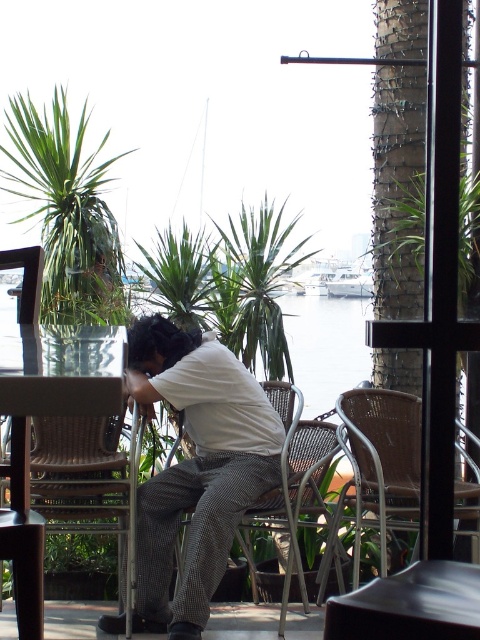
Question: Which of the following is the closest to the observer?

Choices:
 (A) (101, 296)
 (B) (40, 573)

Answer: (B)

Question: Can you confirm if green leafy plant at upper left is wider than woven wicker chair at center?

Choices:
 (A) no
 (B) yes

Answer: (B)

Question: Which point is farther to the camera?

Choices:
 (A) woven wicker chair at center
 (B) woven rattan chair at center
 (C) white cotton shirt at center

Answer: (A)

Question: Which is farther from the green leafy plant at upper left?

Choices:
 (A) wooden table at left
 (B) woven wicker chair at center
 (C) green leafy plant at center

Answer: (A)

Question: Is green leafy plant at upper left above wooden table at left?

Choices:
 (A) yes
 (B) no

Answer: (A)

Question: In this image, where is white cotton shirt at center located relative to green leafy plant at center?

Choices:
 (A) left
 (B) right

Answer: (A)